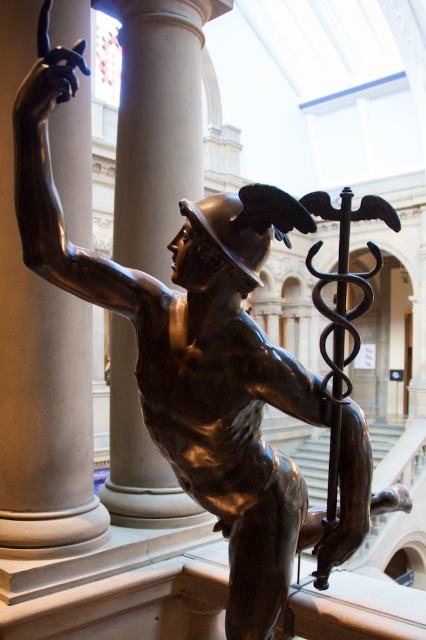
You are an interior designer planning to place a large sculpture between the matte gray column at left and the smooth white column at center. Considering their sizes, which column should the sculpture be placed closer to for visual balance?

The smooth white column at center is larger in size, so placing the sculpture closer to it would create better visual balance.

You are an architect examining the statue and its placement in the room. You notice two points marked in the image. The first point is at coordinate point (28, 465), and the second is at point (190, 188). Based on the statue and its surroundings, which point is closer to the viewer?

Point (28, 465) is in front of point (190, 188), so the first point is closer to the viewer.